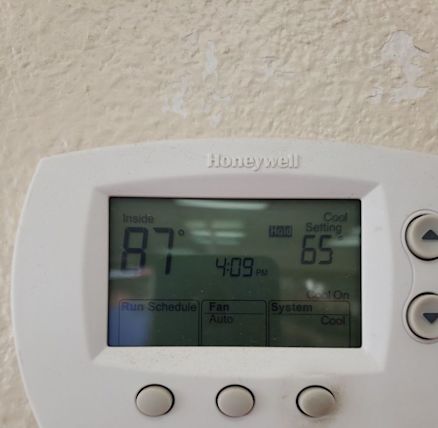
Locate an element on the screen. This screenshot has width=438, height=428. "inside" is located at coordinates (134, 218).